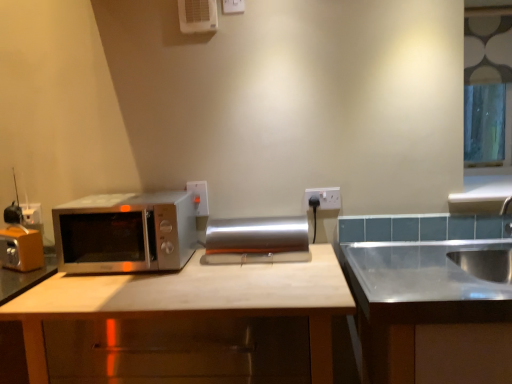
Find the location of a particular element. vacant area located to the right-hand side of satin silver microwave at left is located at coordinates (220, 269).